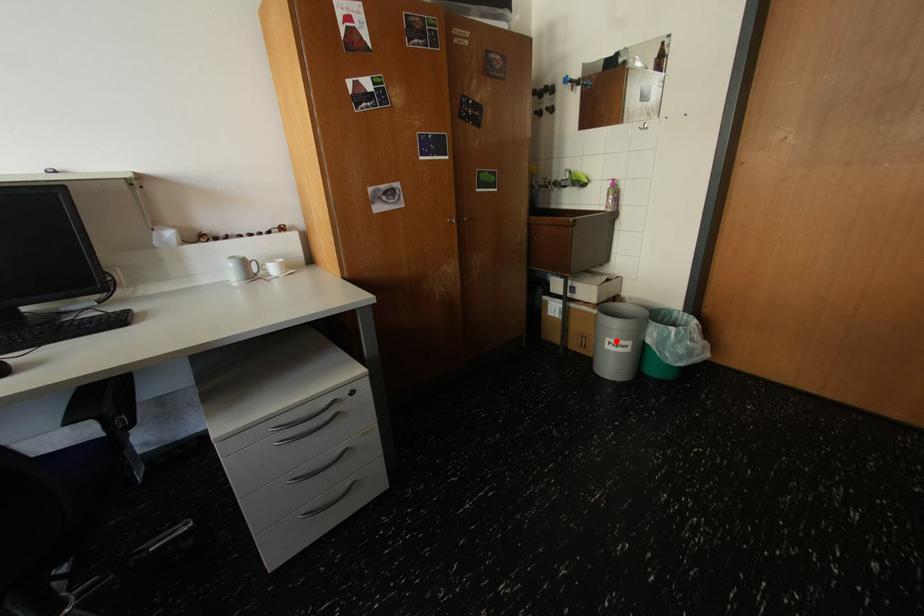
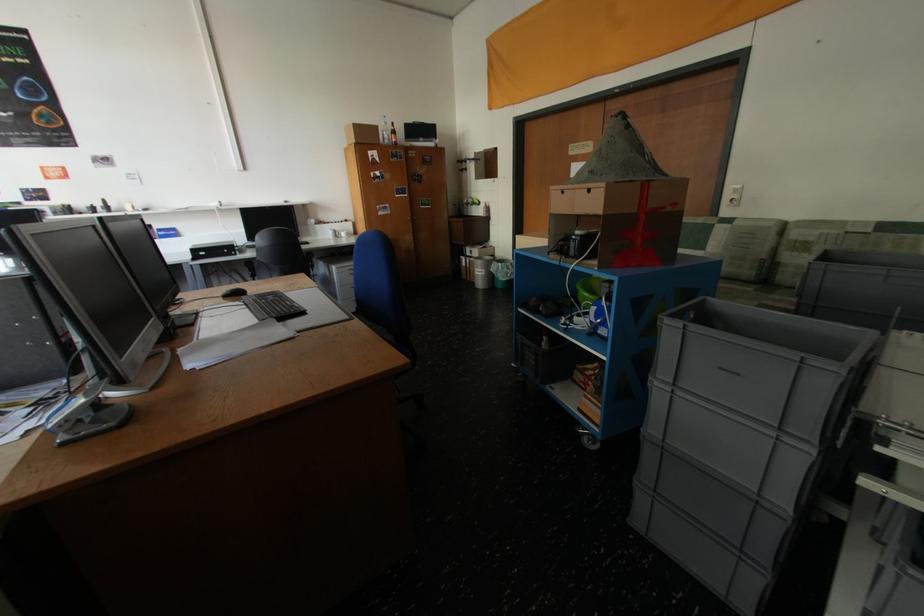
In the second image, find the point that corresponds to the highlighted location in the first image.

(484, 270)